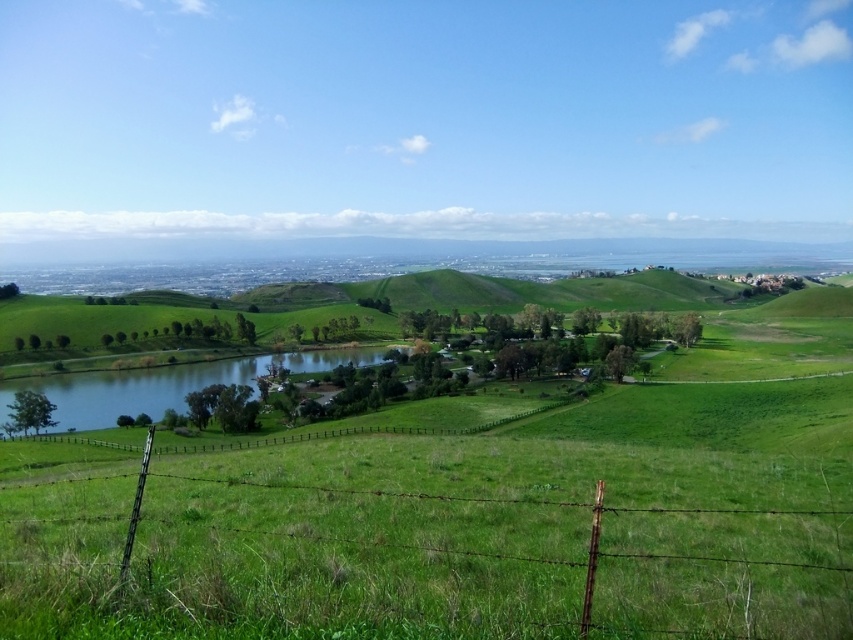
You are standing in the middle of the green field and want to walk towards the green wire fence at lower center. Which direction should you head?

You should head towards the lower center direction to reach the green wire fence at lower center.

You are standing at the edge of the green grassy lake at center and want to walk towards the green wire fence at lower center. In which direction should you head?

The green wire fence at lower center is to the right of green grassy lake at center, so you should head to the right to reach it.